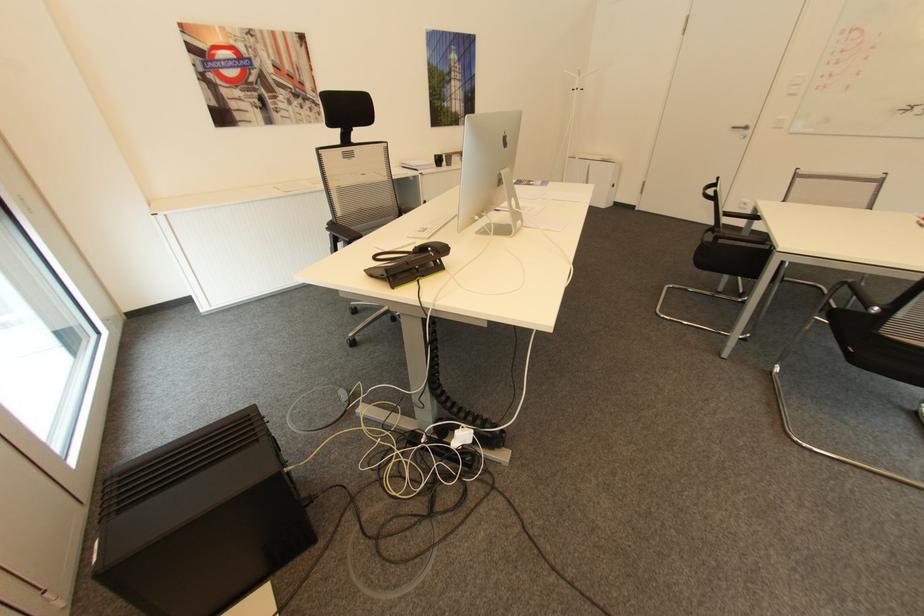
Where would you pull the white cabinet handle? Please return your answer as a coordinate pair (x, y).

(739, 127)